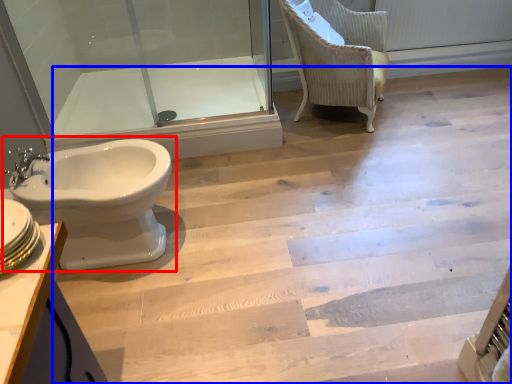
Question: Which object is closer to the camera taking this photo, toilet (highlighted by a red box) or stairwell (highlighted by a blue box)?

Choices:
 (A) toilet
 (B) stairwell

Answer: (B)